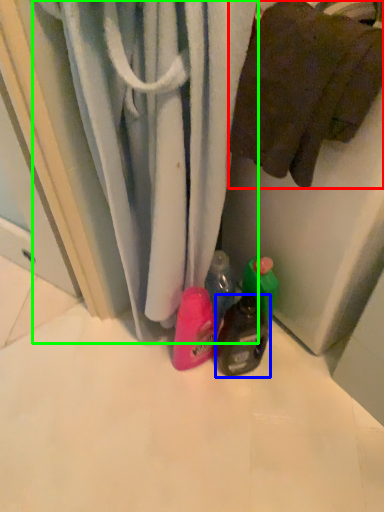
Question: Considering the real-world distances, which object is farthest from towel (highlighted by a red box)? bottle (highlighted by a blue box) or curtain (highlighted by a green box)?

Choices:
 (A) bottle
 (B) curtain

Answer: (A)